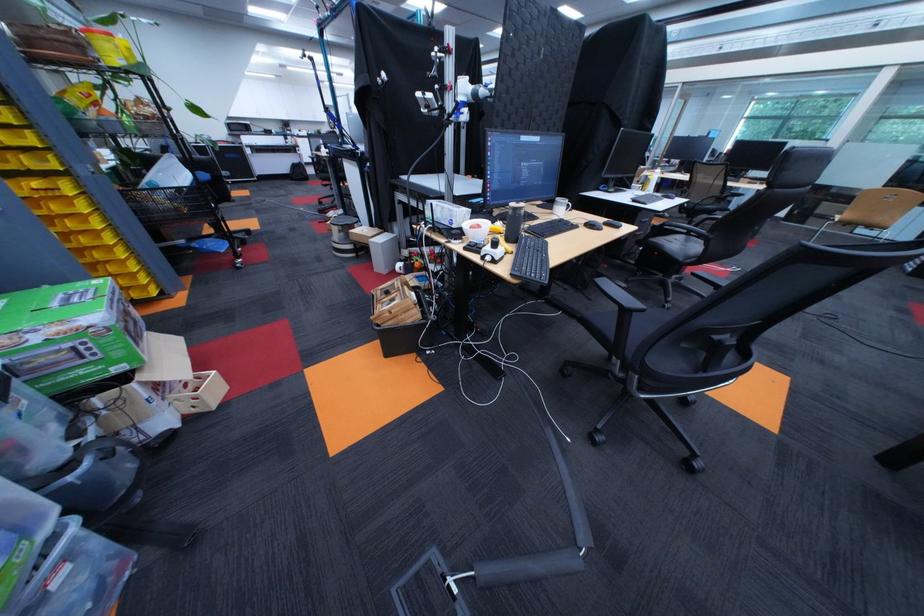
The height and width of the screenshot is (616, 924). What do you see at coordinates (399, 314) in the screenshot?
I see `the black plastic bin` at bounding box center [399, 314].